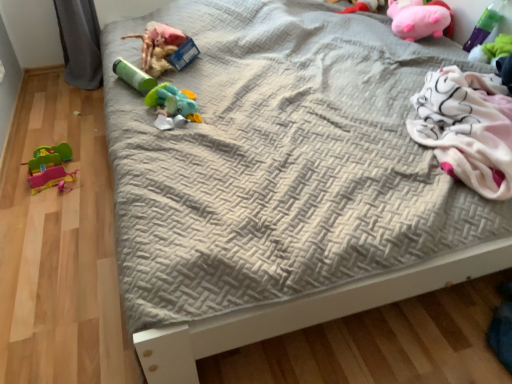
Question: From the image's perspective, is matte green tube at upper left, which is the 3th toy from left to right, on green plastic toy at upper right, arranged as the 1th toy when viewed from the right?

Choices:
 (A) no
 (B) yes

Answer: (A)

Question: Does matte green tube at upper left, which is the 3th toy from left to right, have a greater width compared to green plastic toy at upper right, arranged as the 1th toy when viewed from the right?

Choices:
 (A) no
 (B) yes

Answer: (B)

Question: Considering the relative positions of matte green tube at upper left, which is the 3th toy from left to right, and green plastic toy at upper right, arranged as the 1th toy when viewed from the right, in the image provided, is matte green tube at upper left, which is the 3th toy from left to right, to the right of green plastic toy at upper right, arranged as the 1th toy when viewed from the right, from the viewer's perspective?

Choices:
 (A) no
 (B) yes

Answer: (A)

Question: Is matte green tube at upper left, which is the 3th toy from left to right, positioned beyond the bounds of green plastic toy at upper right, arranged as the 1th toy when viewed from the right?

Choices:
 (A) no
 (B) yes

Answer: (B)

Question: From a real-world perspective, is matte green tube at upper left, marked as the fifth toy in a right-to-left arrangement, beneath green plastic toy at upper right, arranged as the 1th toy when viewed from the right?

Choices:
 (A) no
 (B) yes

Answer: (B)

Question: Could you tell me if matte green tube at upper left, marked as the fifth toy in a right-to-left arrangement, is turned towards green plastic toy at upper right, arranged as the 1th toy when viewed from the right?

Choices:
 (A) yes
 (B) no

Answer: (B)

Question: Can pink plush pig at upper right, which is the 6th toy from left to right, be found inside pink plush toy at upper right, which is the third toy in right-to-left order?

Choices:
 (A) no
 (B) yes

Answer: (A)

Question: Is pink plush toy at upper right, which appears as the fifth toy when viewed from the left, not near pink plush pig at upper right, which is the 6th toy from left to right?

Choices:
 (A) yes
 (B) no

Answer: (B)

Question: Considering the relative sizes of pink plush toy at upper right, which appears as the fifth toy when viewed from the left, and pink plush pig at upper right, which is the 6th toy from left to right, in the image provided, is pink plush toy at upper right, which appears as the fifth toy when viewed from the left, smaller than pink plush pig at upper right, which is the 6th toy from left to right,?

Choices:
 (A) yes
 (B) no

Answer: (A)

Question: Is pink plush toy at upper right, which is the third toy in right-to-left order, to the right of pink plush pig at upper right, the 2th toy from the right, from the viewer's perspective?

Choices:
 (A) yes
 (B) no

Answer: (B)

Question: Is pink plush toy at upper right, which appears as the fifth toy when viewed from the left, to the left of pink plush pig at upper right, the 2th toy from the right, from the viewer's perspective?

Choices:
 (A) yes
 (B) no

Answer: (A)

Question: Considering the relative sizes of pink plush toy at upper right, which is the third toy in right-to-left order, and pink plush pig at upper right, which is the 6th toy from left to right, in the image provided, is pink plush toy at upper right, which is the third toy in right-to-left order, shorter than pink plush pig at upper right, which is the 6th toy from left to right,?

Choices:
 (A) no
 (B) yes

Answer: (B)

Question: From a real-world perspective, is rubberized green and blue toy at center, the fourth toy in the left-to-right sequence, on top of rubber duck at left, acting as the first toy starting from the left?

Choices:
 (A) no
 (B) yes

Answer: (B)